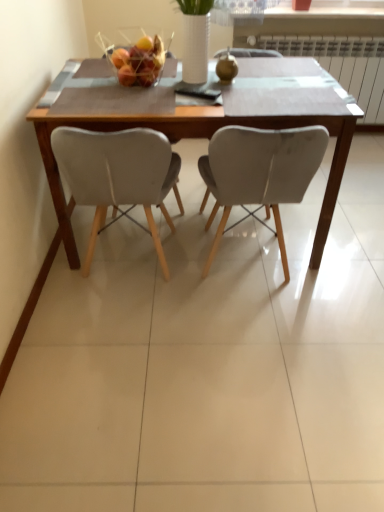
This screenshot has width=384, height=512. Find the location of `wooden table at center`. wooden table at center is located at coordinates (209, 122).

What is the approximate width of white plastic radiator at upper right?

It is 7.14 inches.

Image resolution: width=384 pixels, height=512 pixels. In order to click on wooden table at center in this screenshot , I will do `click(209, 122)`.

From the metallic wire basket at center, count 1st chairs forward and point to it. Please provide its 2D coordinates.

[(118, 175)]

From the image's perspective, who appears lower, metallic wire basket at center or matte gray chair at center, the first chair from the left?

matte gray chair at center, the first chair from the left, from the image's perspective.

Considering the positions of objects metallic wire basket at center and matte gray chair at center, the first chair from the left, in the image provided, who is more to the left, metallic wire basket at center or matte gray chair at center, the first chair from the left,?

matte gray chair at center, the first chair from the left.

How many degrees apart are the facing directions of metallic wire basket at center and matte gray chair at center, which is counted as the 2th chair, starting from the right?

There is a 89.6-degree angle between the facing directions of metallic wire basket at center and matte gray chair at center, which is counted as the 2th chair, starting from the right.

Which is more to the right, white plastic radiator at upper right or matte gray chair at center, the first chair from the left?

white plastic radiator at upper right.

Is point (357, 91) positioned after point (173, 156)?

Yes, it is.

Is white plastic radiator at upper right oriented towards matte gray chair at center, the first chair from the left?

Yes, white plastic radiator at upper right is facing matte gray chair at center, the first chair from the left.

Can you confirm if white plastic radiator at upper right is shorter than matte gray chair at center, which is counted as the 2th chair, starting from the right?

Correct, white plastic radiator at upper right is not as tall as matte gray chair at center, which is counted as the 2th chair, starting from the right.

Is metallic wire basket at center at the back of wooden table at center?

No, wooden table at center's orientation is not away from metallic wire basket at center.

Measure the distance from wooden table at center to metallic wire basket at center.

wooden table at center is 13.76 inches from metallic wire basket at center.

Where is `table on the right of metallic wire basket at center`? Image resolution: width=384 pixels, height=512 pixels. table on the right of metallic wire basket at center is located at coordinates (209, 122).

Based on the photo, can you confirm if wooden table at center is thinner than metallic wire basket at center?

No.

In the scene shown: Can you confirm if wooden table at center is positioned to the right of white plastic radiator at upper right?

In fact, wooden table at center is to the left of white plastic radiator at upper right.

Identify the location of table located on the left of white plastic radiator at upper right. (209, 122).

Is wooden table at center turned away from white plastic radiator at upper right?

wooden table at center does not have its back to white plastic radiator at upper right.

Is wooden table at center not near white plastic radiator at upper right?

That's right, there is a large distance between wooden table at center and white plastic radiator at upper right.

Could you tell me if matte gray chair at center, which is counted as the 2th chair, starting from the right, is facing wooden table at center?

Yes, matte gray chair at center, which is counted as the 2th chair, starting from the right, is aimed at wooden table at center.

Between matte gray chair at center, the first chair from the left, and wooden table at center, which one is positioned in front?

matte gray chair at center, the first chair from the left, is more forward.

Considering the relative sizes of matte gray chair at center, which is counted as the 2th chair, starting from the right, and wooden table at center in the image provided, is matte gray chair at center, which is counted as the 2th chair, starting from the right, shorter than wooden table at center?

Incorrect, the height of matte gray chair at center, which is counted as the 2th chair, starting from the right, does not fall short of that of wooden table at center.

Considering the relative positions of matte gray chair at center, the first chair from the left, and wooden table at center in the image provided, is matte gray chair at center, the first chair from the left, to the left of wooden table at center from the viewer's perspective?

Indeed, matte gray chair at center, the first chair from the left, is positioned on the left side of wooden table at center.

From a real-world perspective, is white plastic radiator at upper right positioned over matte gray chair at center, marked as the 2th chair in a left-to-right arrangement, based on gravity?

No, from a real-world perspective, white plastic radiator at upper right is not above matte gray chair at center, marked as the 2th chair in a left-to-right arrangement.

Consider the image. Considering the sizes of white plastic radiator at upper right and matte gray chair at center, marked as the 2th chair in a left-to-right arrangement, in the image, is white plastic radiator at upper right wider or thinner than matte gray chair at center, marked as the 2th chair in a left-to-right arrangement,?

In the image, white plastic radiator at upper right appears to be more narrow than matte gray chair at center, marked as the 2th chair in a left-to-right arrangement.

Would you say white plastic radiator at upper right is inside or outside matte gray chair at center, marked as the 2th chair in a left-to-right arrangement?

The correct answer is: outside.

Is white plastic radiator at upper right at the right side of matte gray chair at center, marked as the 2th chair in a left-to-right arrangement?

Indeed, white plastic radiator at upper right is positioned on the right side of matte gray chair at center, marked as the 2th chair in a left-to-right arrangement.

This screenshot has width=384, height=512. I want to click on fruit dish above the matte gray chair at center, which is counted as the 2th chair, starting from the right (from a real-world perspective), so click(x=139, y=61).

Is point (77, 141) more distant than point (158, 73)?

That is False.

How many degrees apart are the facing directions of matte gray chair at center, which is counted as the 2th chair, starting from the right, and metallic wire basket at center?

They differ by 89.6 degrees in their facing directions.

Is matte gray chair at center, the first chair from the left, taller or shorter than metallic wire basket at center?

matte gray chair at center, the first chair from the left, is taller than metallic wire basket at center.

In order to click on the 2nd chair below the metallic wire basket at center (from the image's perspective) in this screenshot , I will do `click(118, 175)`.

Where is `the 2nd chair counting from the left side of the white plastic radiator at upper right`? the 2nd chair counting from the left side of the white plastic radiator at upper right is located at coordinates (118, 175).

Considering their positions, is white plastic radiator at upper right positioned closer to metallic wire basket at center than wooden table at center?

wooden table at center lies closer to metallic wire basket at center than the other object.

When comparing their distances from white plastic radiator at upper right, does wooden table at center or metallic wire basket at center seem closer?

wooden table at center.

Looking at the image, which one is located closer to metallic wire basket at center, matte gray chair at center, the first chair from the left, or matte gray chair at center, which is the 1th chair from right to left?

matte gray chair at center, the first chair from the left, is closer to metallic wire basket at center.

When comparing their distances from wooden table at center, does white plastic radiator at upper right or matte gray chair at center, the first chair from the left, seem further?

Based on the image, white plastic radiator at upper right appears to be further to wooden table at center.

Estimate the real-world distances between objects in this image. Which object is closer to wooden table at center, matte gray chair at center, which is the 1th chair from right to left, or matte gray chair at center, which is counted as the 2th chair, starting from the right?

matte gray chair at center, which is the 1th chair from right to left, is closer to wooden table at center.

Which object lies further to the anchor point wooden table at center, matte gray chair at center, which is counted as the 2th chair, starting from the right, or matte gray chair at center, which is the 1th chair from right to left?

Among the two, matte gray chair at center, which is counted as the 2th chair, starting from the right, is located further to wooden table at center.

From the image, which object appears to be farther from matte gray chair at center, marked as the 2th chair in a left-to-right arrangement, matte gray chair at center, the first chair from the left, or metallic wire basket at center?

Among the two, metallic wire basket at center is located further to matte gray chair at center, marked as the 2th chair in a left-to-right arrangement.

Looking at the image, which one is located further to wooden table at center, metallic wire basket at center or matte gray chair at center, the first chair from the left?

Based on the image, metallic wire basket at center appears to be further to wooden table at center.

Where is `table between matte gray chair at center, marked as the 2th chair in a left-to-right arrangement, and white plastic radiator at upper right in the front-back direction`? The image size is (384, 512). table between matte gray chair at center, marked as the 2th chair in a left-to-right arrangement, and white plastic radiator at upper right in the front-back direction is located at coordinates (209, 122).

This screenshot has width=384, height=512. Find the location of `table between metallic wire basket at center and matte gray chair at center, marked as the 2th chair in a left-to-right arrangement, in the vertical direction`. table between metallic wire basket at center and matte gray chair at center, marked as the 2th chair in a left-to-right arrangement, in the vertical direction is located at coordinates (209, 122).

This screenshot has width=384, height=512. Identify the location of chair between matte gray chair at center, marked as the 2th chair in a left-to-right arrangement, and white plastic radiator at upper right, along the z-axis. (118, 175).

This screenshot has width=384, height=512. I want to click on table that lies between metallic wire basket at center and matte gray chair at center, which is counted as the 2th chair, starting from the right, from top to bottom, so click(x=209, y=122).